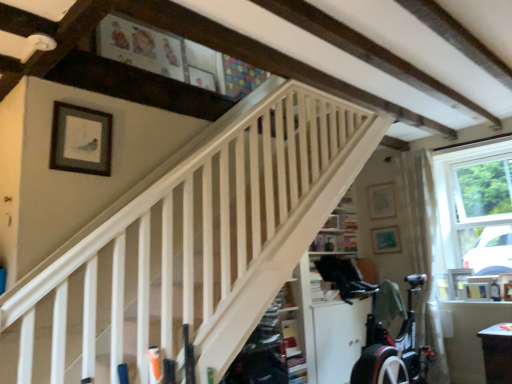
Question: Relative to matte black picture frame at upper left, the 6th picture frame in the bottom-to-top sequence, is green matte picture frame at upper right, which is the third picture frame from left to right, in front or behind?

Choices:
 (A) behind
 (B) front

Answer: (A)

Question: Is green matte picture frame at upper right, the 3th picture frame viewed from the top, to the left or to the right of matte black picture frame at upper left, the 6th picture frame in the bottom-to-top sequence, in the image?

Choices:
 (A) right
 (B) left

Answer: (A)

Question: Based on their relative distances, which object is nearer to the matte wooden picture frame at upper right, marked as the 2th picture frame in a top-to-bottom arrangement?

Choices:
 (A) white wooden stairs at center
 (B) matte black picture frame at lower right, which appears as the sixth picture frame when viewed from the top
 (C) white glossy table at lower right
 (D) wooden picture frame at right, which appears as the 4th picture frame when viewed from the front
 (E) matte black picture frame at upper left, which is the 1th picture frame from left to right

Answer: (D)

Question: Estimate the real-world distances between objects in this image. Which object is farther from the wooden picture frame at right, which is the first picture frame from right to left?

Choices:
 (A) matte black picture frame at lower right, the 2th picture frame viewed from the right
 (B) matte black picture frame at upper left, marked as the 6th picture frame in a right-to-left arrangement
 (C) white glossy table at lower right
 (D) wooden picture frame at right, the second picture frame when ordered from bottom to top
 (E) green matte picture frame at upper right, marked as the 4th picture frame in a bottom-to-top arrangement

Answer: (B)